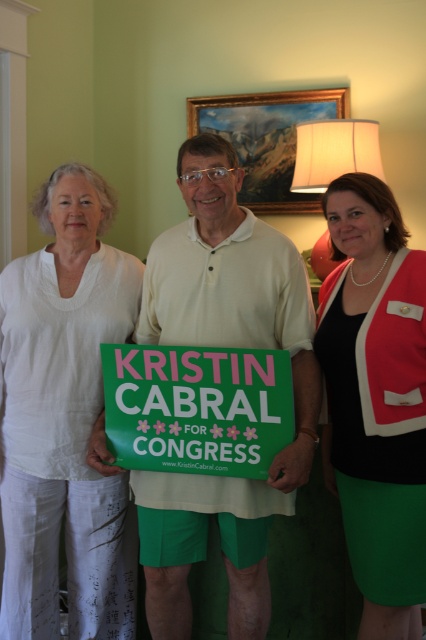
Who is lower down, white cotton polo shirt at center or green satin skirt at center?

green satin skirt at center is lower down.

Who is higher up, white cotton polo shirt at center or green satin skirt at center?

Positioned higher is white cotton polo shirt at center.

Between point (215, 288) and point (362, 321), which one is positioned behind?

Positioned behind is point (215, 288).

The image size is (426, 640). I want to click on white cotton polo shirt at center, so click(224, 346).

Which is more to the right, white linen pants at left or white cotton polo shirt at center?

From the viewer's perspective, white cotton polo shirt at center appears more on the right side.

Does white linen pants at left have a smaller size compared to white cotton polo shirt at center?

Yes, white linen pants at left is smaller than white cotton polo shirt at center.

Which is behind, point (43, 403) or point (201, 196)?

Positioned behind is point (43, 403).

Where is `white linen pants at left`? white linen pants at left is located at coordinates (63, 419).

Who is lower down, white cotton polo shirt at center or green matte sign at center?

Positioned lower is green matte sign at center.

Does point (150, 582) come farther from viewer compared to point (210, 406)?

Yes, it is.

Who is more distant from viewer, (244, 266) or (126, 440)?

The point (244, 266) is more distant.

In order to click on white cotton polo shirt at center in this screenshot , I will do `click(224, 346)`.